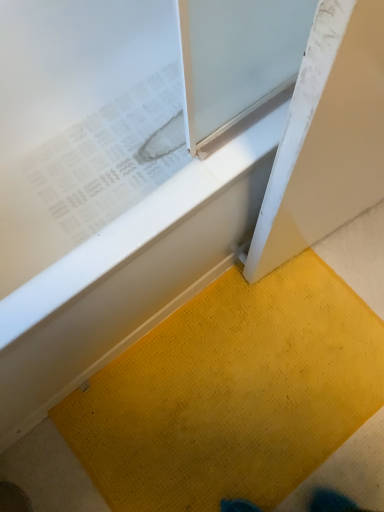
This screenshot has height=512, width=384. I want to click on yellow rubber mat at lower center, so click(x=126, y=173).

This screenshot has height=512, width=384. Describe the element at coordinates (126, 173) in the screenshot. I see `yellow rubber mat at lower center` at that location.

This screenshot has width=384, height=512. Find the location of `yellow rubber mat at lower center`. yellow rubber mat at lower center is located at coordinates (126, 173).